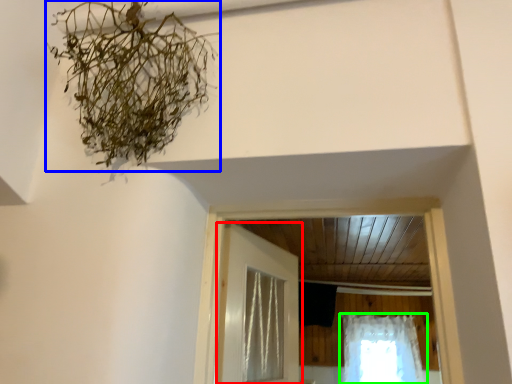
Question: Which is nearer to the door (highlighted by a red box)? plant (highlighted by a blue box) or curtain (highlighted by a green box).

Choices:
 (A) plant
 (B) curtain

Answer: (A)